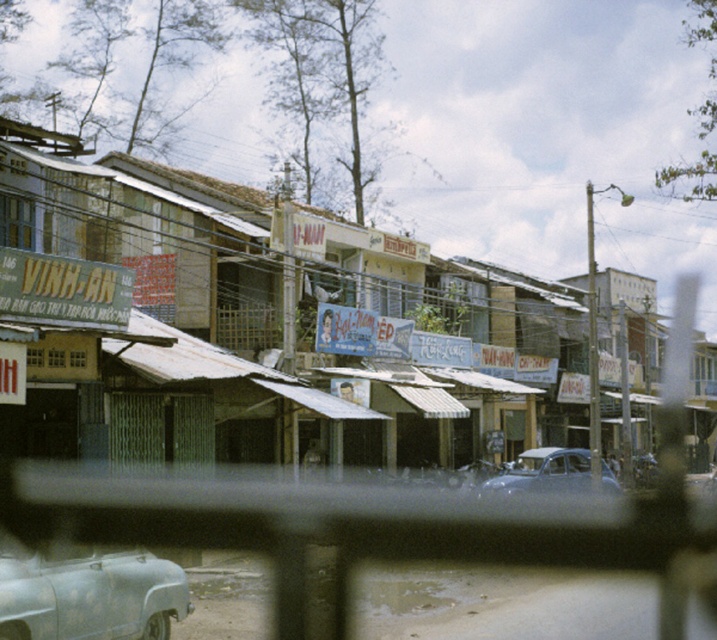
Question: Based on their relative distances, which object is nearer to the rusty metal signboard at center?

Choices:
 (A) matte gray car at center
 (B) rusty metallic car at lower left

Answer: (A)

Question: Which point appears closest to the camera in this image?

Choices:
 (A) (571, 458)
 (B) (212, 209)

Answer: (B)

Question: Is rusty metallic car at lower left further to camera compared to matte gray car at center?

Choices:
 (A) no
 (B) yes

Answer: (A)

Question: Which point is closer to the camera taking this photo?

Choices:
 (A) (123, 628)
 (B) (270, 400)
 (C) (503, 486)

Answer: (A)

Question: Is rusty metal signboard at center to the left of matte gray car at center from the viewer's perspective?

Choices:
 (A) yes
 (B) no

Answer: (A)

Question: Does rusty metal signboard at center have a lesser width compared to rusty metallic car at lower left?

Choices:
 (A) no
 (B) yes

Answer: (A)